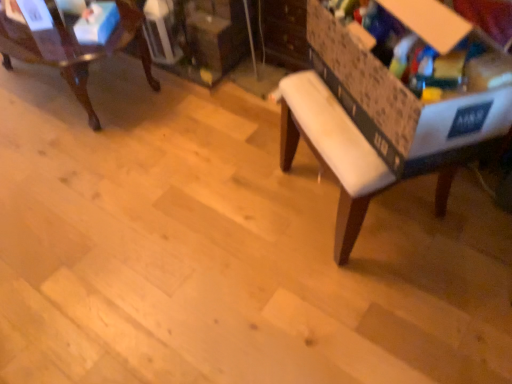
Question: Does white fabric bench at center come in front of cardboard storage box at right, the first storage box viewed from the front?

Choices:
 (A) no
 (B) yes

Answer: (B)

Question: Is white fabric bench at center to the left of cardboard storage box at right, which appears as the 2th storage box when viewed from the back, from the viewer's perspective?

Choices:
 (A) no
 (B) yes

Answer: (A)

Question: Could you tell me if white fabric bench at center is facing cardboard storage box at right, the first storage box viewed from the front?

Choices:
 (A) yes
 (B) no

Answer: (A)

Question: Is white fabric bench at center placed right next to cardboard storage box at right, the first storage box viewed from the front?

Choices:
 (A) no
 (B) yes

Answer: (A)

Question: Is white fabric bench at center behind cardboard storage box at right, positioned as the first storage box in right-to-left order?

Choices:
 (A) yes
 (B) no

Answer: (B)

Question: In terms of height, does mahogany wood chair at upper left look taller or shorter compared to blue cardboard box at upper left, arranged as the 1th storage box when viewed from the left?

Choices:
 (A) tall
 (B) short

Answer: (A)

Question: Is point (129, 8) closer or farther from the camera than point (82, 34)?

Choices:
 (A) closer
 (B) farther

Answer: (B)

Question: From the image's perspective, relative to blue cardboard box at upper left, which is the 2th storage box in front-to-back order, is mahogany wood chair at upper left above or below?

Choices:
 (A) below
 (B) above

Answer: (B)

Question: Would you say mahogany wood chair at upper left is inside or outside blue cardboard box at upper left, the 2th storage box from the right?

Choices:
 (A) inside
 (B) outside

Answer: (B)

Question: Relative to white fabric bench at center, is blue cardboard box at upper left, the 2th storage box from the right, in front or behind?

Choices:
 (A) behind
 (B) front

Answer: (A)

Question: Is point (84, 44) positioned closer to the camera than point (344, 145)?

Choices:
 (A) closer
 (B) farther

Answer: (B)

Question: Visually, is blue cardboard box at upper left, which is counted as the first storage box, starting from the back, positioned to the left or to the right of white fabric bench at center?

Choices:
 (A) right
 (B) left

Answer: (B)

Question: From a real-world perspective, relative to white fabric bench at center, is blue cardboard box at upper left, which is the 2th storage box in front-to-back order, vertically above or below?

Choices:
 (A) above
 (B) below

Answer: (B)

Question: Relative to cardboard storage box at right, positioned as the first storage box in right-to-left order, is blue cardboard box at upper left, which is the 2th storage box in front-to-back order, in front or behind?

Choices:
 (A) behind
 (B) front

Answer: (A)

Question: From a real-world perspective, is blue cardboard box at upper left, arranged as the 1th storage box when viewed from the left, positioned above or below cardboard storage box at right, positioned as the first storage box in right-to-left order?

Choices:
 (A) above
 (B) below

Answer: (B)